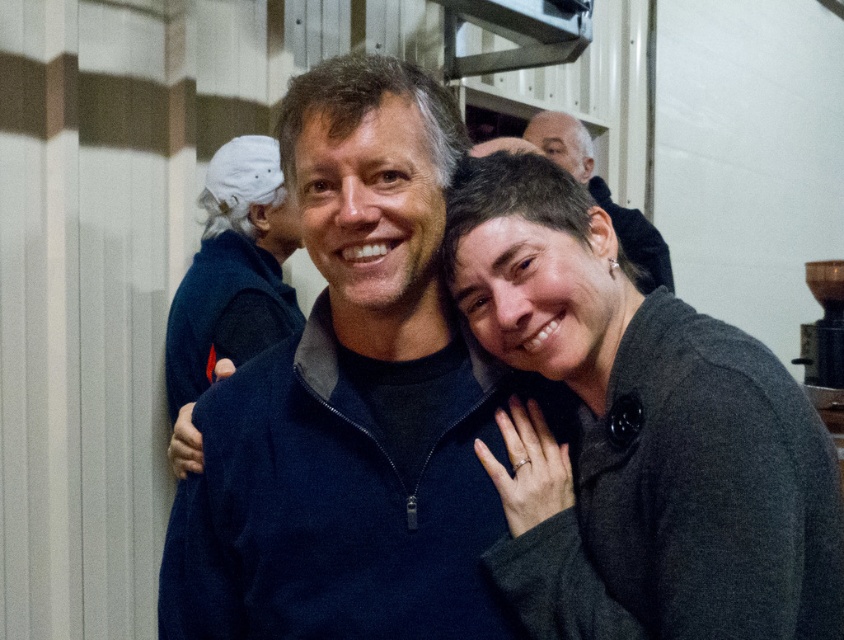
In the scene shown: Is gray woolen sweater at center smaller than matte black sweater at center?

Indeed, gray woolen sweater at center has a smaller size compared to matte black sweater at center.

From the picture: Who is taller, gray woolen sweater at center or matte black sweater at center?

With more height is matte black sweater at center.

Between point (579, 332) and point (583, 170), which one is positioned in front?

Point (579, 332) is in front.

Locate an element on the screen. The width and height of the screenshot is (844, 640). gray woolen sweater at center is located at coordinates (639, 435).

Between dark blue fleece at center and gray woolen sweater at center, which one is positioned higher?

Positioned higher is gray woolen sweater at center.

Locate an element on the screen. The height and width of the screenshot is (640, 844). dark blue fleece at center is located at coordinates (482, 429).

The height and width of the screenshot is (640, 844). I want to click on dark blue fleece at center, so click(482, 429).

Who is positioned more to the left, dark blue fleece at center or matte black sweater at center?

dark blue fleece at center

Who is taller, dark blue fleece at center or matte black sweater at center?

dark blue fleece at center is taller.

The width and height of the screenshot is (844, 640). I want to click on dark blue fleece at center, so click(482, 429).